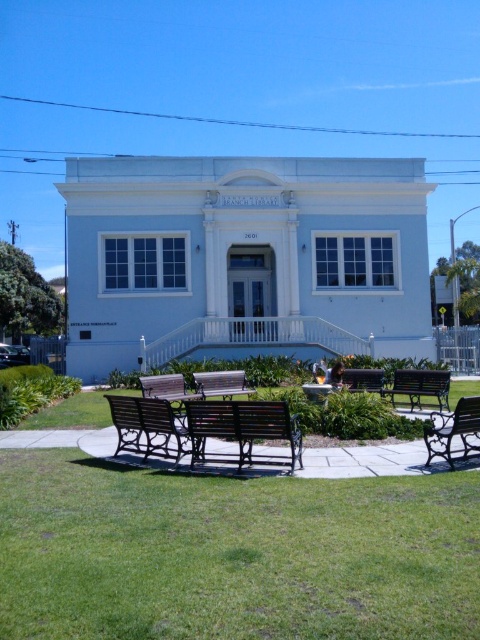
Is wooden park bench at center smaller than brown wooden bench at center?

No.

From the picture: Can you confirm if wooden park bench at center is positioned to the left of brown wooden bench at center?

Incorrect, wooden park bench at center is not on the left side of brown wooden bench at center.

Between point (266, 456) and point (163, 392), which one is positioned behind?

Positioned behind is point (163, 392).

Find the location of a particular element. The image size is (480, 640). wooden park bench at center is located at coordinates (242, 432).

Between point (472, 429) and point (208, 396), which one is positioned in front?

Point (472, 429)

What do you see at coordinates (454, 429) in the screenshot? I see `black wrought iron bench at lower right` at bounding box center [454, 429].

Where is `black wrought iron bench at lower right`? Image resolution: width=480 pixels, height=640 pixels. black wrought iron bench at lower right is located at coordinates (454, 429).

Where is `black wrought iron bench at lower right`? black wrought iron bench at lower right is located at coordinates pos(454,429).

Is green grass at lower center bigger than dark brown wooden bench at center?

Incorrect, green grass at lower center is not larger than dark brown wooden bench at center.

Is green grass at lower center to the left of dark brown wooden bench at center from the viewer's perspective?

Yes, green grass at lower center is to the left of dark brown wooden bench at center.

Describe the element at coordinates (232, 554) in the screenshot. I see `green grass at lower center` at that location.

Identify the location of green grass at lower center. (232, 554).